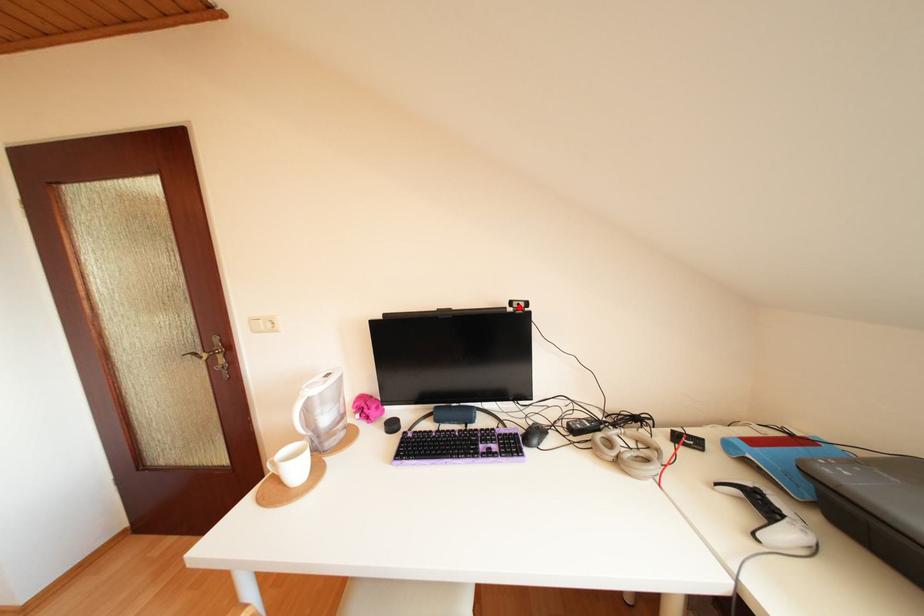
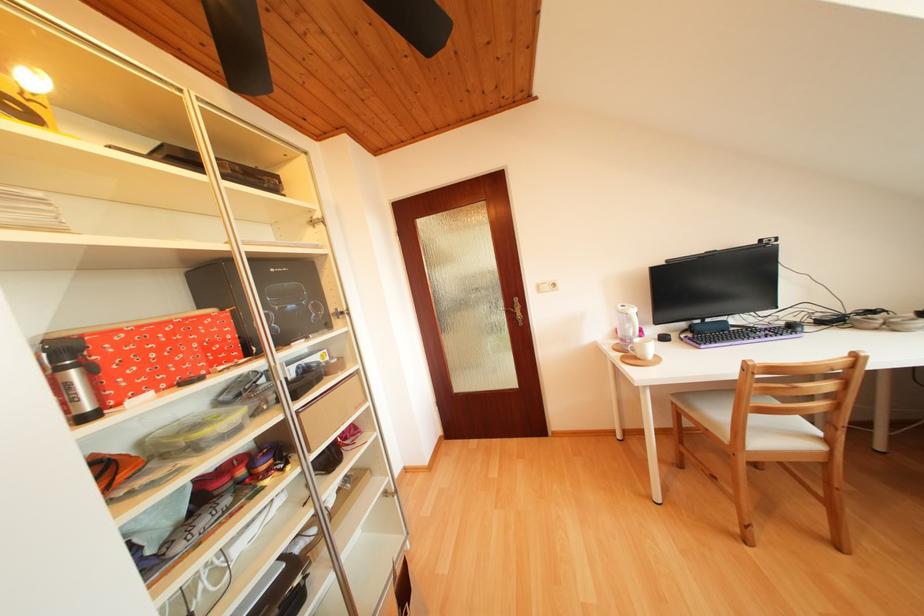
The point at the highlighted location is marked in the first image. Where is the corresponding point in the second image?

(769, 246)